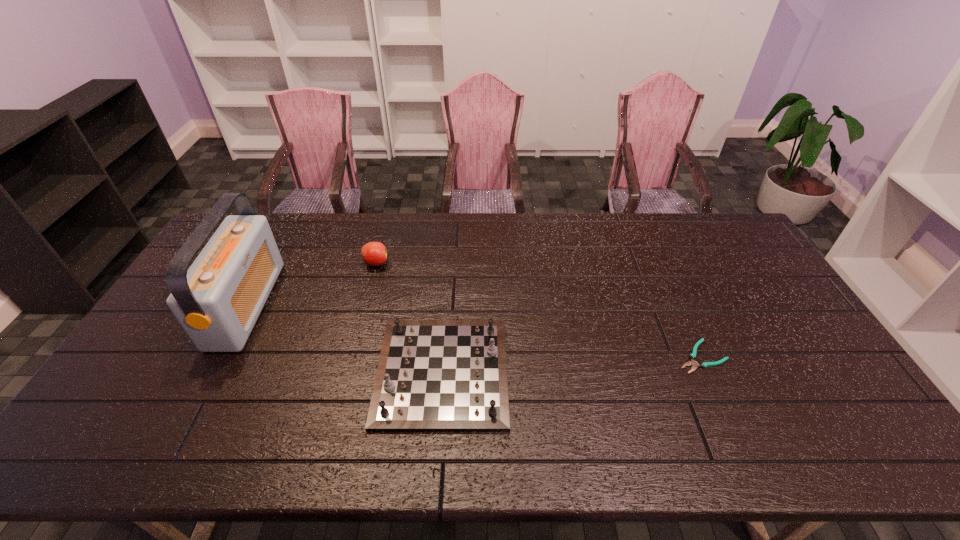
At what (x,y) coordinates should I click in order to perform the action: click on vacant space located 0.240m on the back of the rightmost object. Please return your answer as a coordinate pair (x, y). The width and height of the screenshot is (960, 540). Looking at the image, I should click on (667, 282).

Locate an element on the screen. This screenshot has width=960, height=540. object located in the near edge section of the desktop is located at coordinates (433, 375).

In the image, there is a desktop. At what (x,y) coordinates should I click in order to perform the action: click on blank space at the far edge. Please return your answer as a coordinate pair (x, y). Looking at the image, I should click on (292, 249).

Locate an element on the screen. Image resolution: width=960 pixels, height=540 pixels. free spot at the near edge of the desktop is located at coordinates (574, 431).

This screenshot has height=540, width=960. I want to click on free space at the far right corner, so click(x=701, y=222).

This screenshot has height=540, width=960. Identify the location of vacant point located between the second object from left to right and the third tallest object. (409, 318).

Find the location of a particular element. Image resolution: width=960 pixels, height=540 pixels. free space between the leftmost object and the chessboard is located at coordinates (345, 338).

This screenshot has height=540, width=960. I want to click on free space between the apple and the pliers, so click(539, 310).

Locate an element on the screen. Image resolution: width=960 pixels, height=540 pixels. free area in between the radio receiver and the apple is located at coordinates (311, 284).

Where is `free space between the third object from left to right and the apple`? Image resolution: width=960 pixels, height=540 pixels. free space between the third object from left to right and the apple is located at coordinates (409, 318).